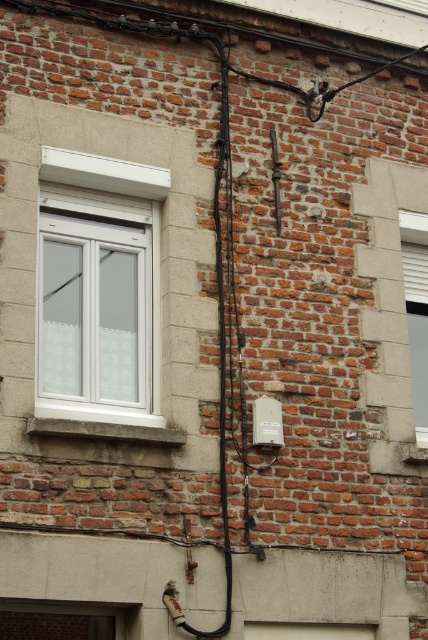
Question: Which point is farther from the camera taking this photo?

Choices:
 (A) (x=413, y=234)
 (B) (x=86, y=333)

Answer: (A)

Question: Can you confirm if white plastic window at upper left is positioned to the right of white textured window at right?

Choices:
 (A) no
 (B) yes

Answer: (A)

Question: Does white plastic window at upper left appear on the right side of white textured window at right?

Choices:
 (A) yes
 (B) no

Answer: (B)

Question: Among these objects, which one is nearest to the camera?

Choices:
 (A) white plastic window at upper left
 (B) white textured window at right

Answer: (A)

Question: Is white plastic window at upper left wider than white textured window at right?

Choices:
 (A) yes
 (B) no

Answer: (A)